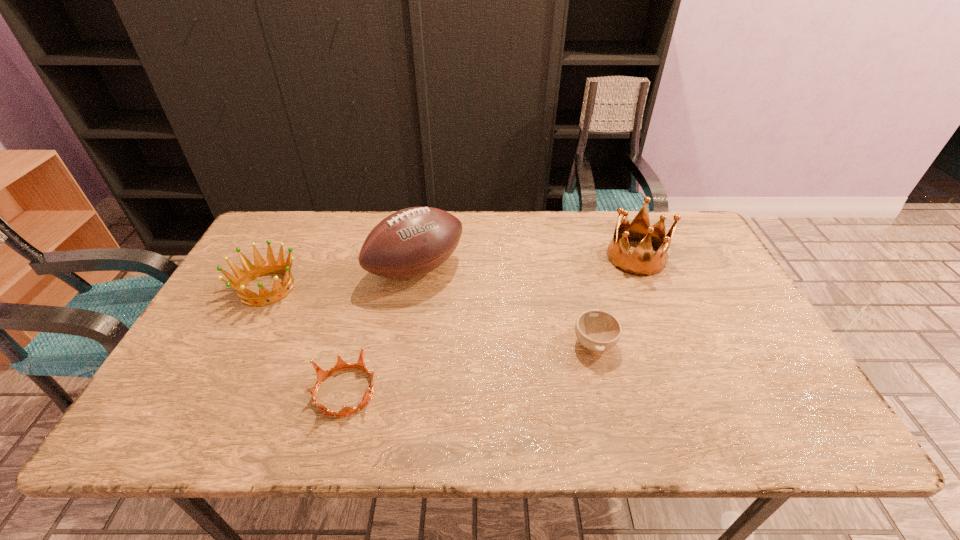
At what (x,y) coordinates should I click in order to perform the action: click on vacant position in the image that satisfies the following two spatial constraints: 1. on the back side of the football (American); 2. on the right side of the rightmost crown. Please return your answer as a coordinate pair (x, y). This screenshot has width=960, height=540. Looking at the image, I should click on (419, 258).